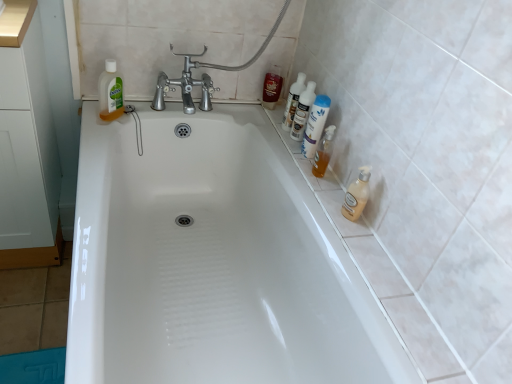
Find the location of a particular element. free space that is in between shiny red can at upper right, which is the third toiletry from front to back, and translucent plastic bottle at upper left, acting as the 4th cleaning product starting from the right is located at coordinates (194, 107).